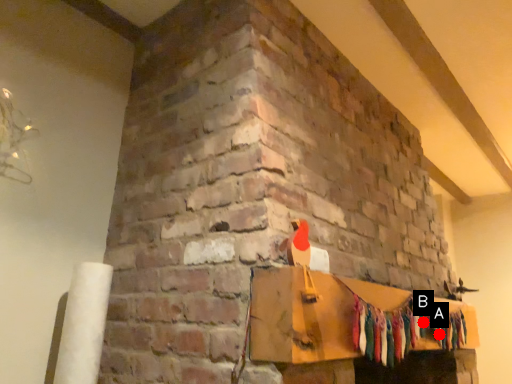
Question: Two points are circled on the image, labeled by A and B beside each circle. Which point is closer to the camera?

Choices:
 (A) A is closer
 (B) B is closer

Answer: (B)